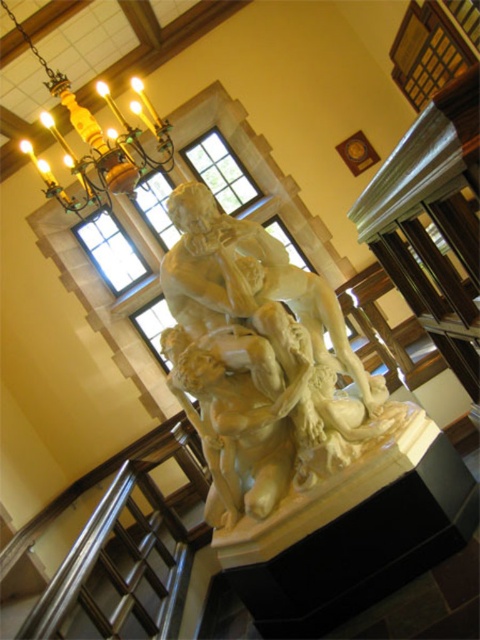
You are an interior designer assessing the space. The white marble sculpture at center and the gold polished metal chandelier at upper left are both central to the room design. Which object is taller?

The white marble sculpture at center is taller than the gold polished metal chandelier at upper left according to the description.

You are an interior designer planning to move the white marble sculpture at center closer to the gold polished metal chandelier at upper left. Based on their current positions, which direction should you move the sculpture to achieve this?

The white marble sculpture at center is currently positioned on the right side of the gold polished metal chandelier at upper left. To move it closer, you should move it to the left.